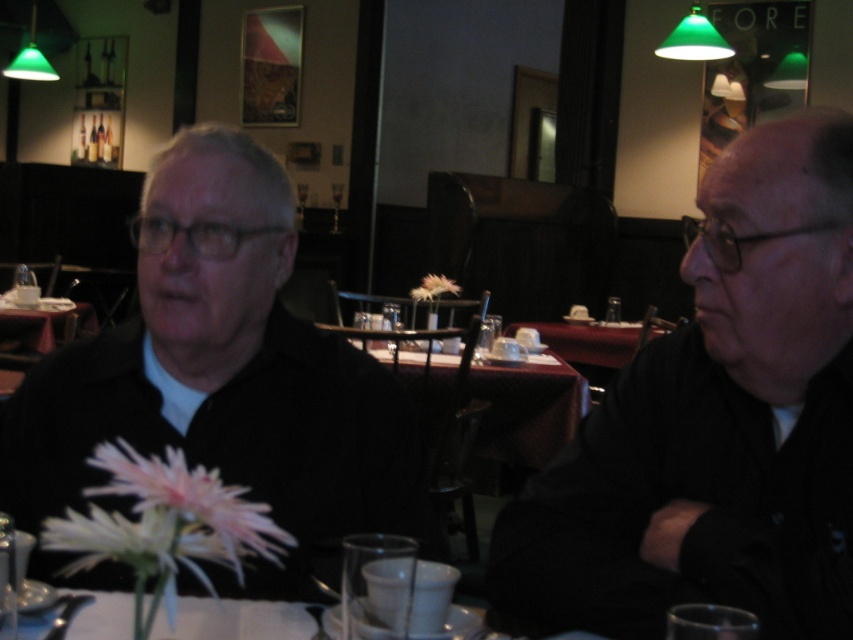
You are a photographer trying to capture both the black matte jacket at right and the black matte jacket at left in a single frame. Based on their sizes in the image, which jacket should you focus on to ensure both are clearly visible?

The black matte jacket at right occupies less space than the black matte jacket at left, so focusing on the larger jacket at left would help ensure both are visible in the frame.

You are a photographer setting up for a photoshoot at this restaurant table. You need to place a 1.2 meter wide backdrop behind the black matte jacket at left and the wooden table at center. Can the backdrop fit behind both objects without overlapping them?

The black matte jacket at left is wider than the wooden table at center. Since the backdrop is 1.2 meters wide, it can fit behind both objects as the total width required would be less than 1.2 meters, provided their combined width is within that measurement.

You are a photographer trying to capture a closeup of the black matte jacket at right and the maroon fabric table at center. Which object should you focus on first to ensure both are in focus without adjusting the camera settings?

The black matte jacket at right is closer to the viewer than the maroon fabric table at center, so you should focus on the black matte jacket at right first to ensure both are in focus since it is nearer.